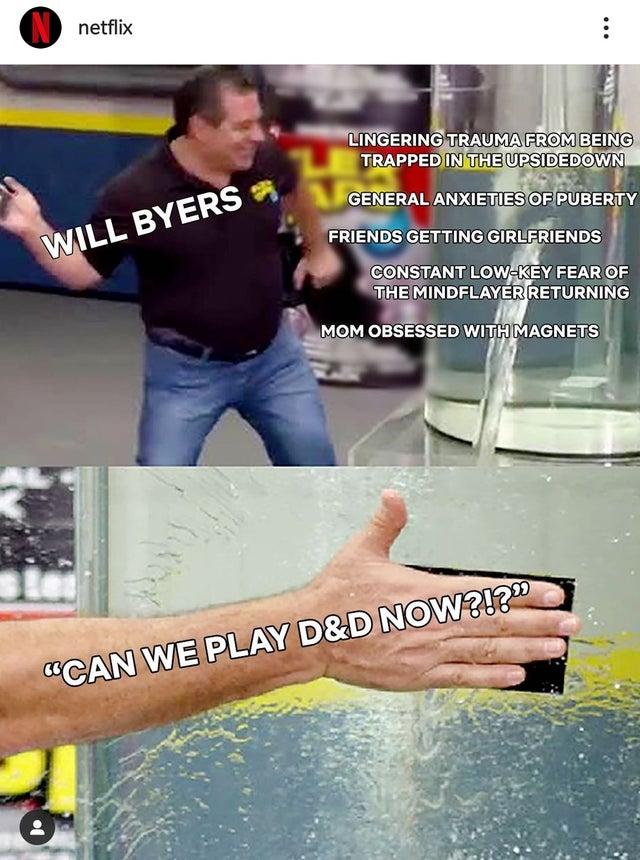
At what (x,y) coordinates should I click in order to perform the action: click on floor. Please return your answer as a coordinate pair (x, y). The height and width of the screenshot is (860, 640). Looking at the image, I should click on [x=72, y=364].